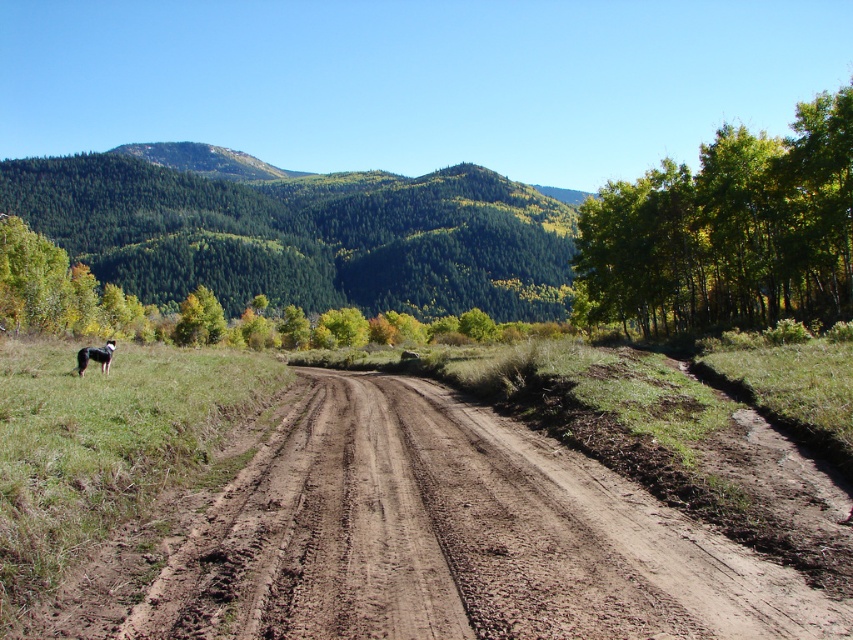
You are a hiker standing on the dirt road and see the green forested hillside at upper left and the black fur dog at lower left. Which object is taller when viewed from your position?

The green forested hillside at upper left is taller than the black fur dog at lower left.